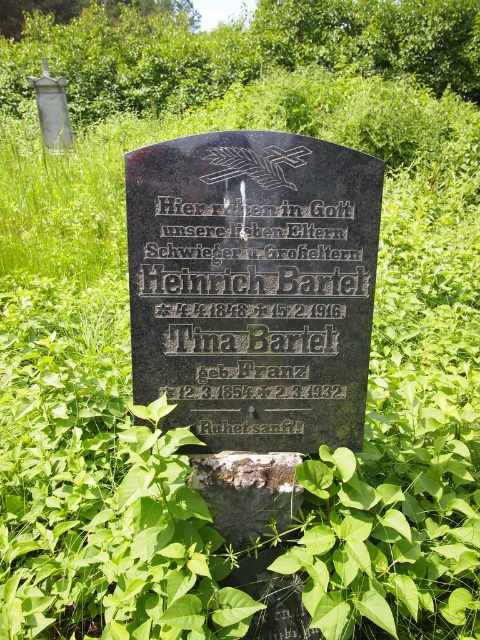
Does black polished stone plaque at center appear on the left side of rusty metal gravestone at center?

Yes, black polished stone plaque at center is to the left of rusty metal gravestone at center.

Is black polished stone plaque at center behind rusty metal gravestone at center?

No, black polished stone plaque at center is closer to the viewer.

Who is more forward, (296, 326) or (225, 467)?

Point (296, 326)

Image resolution: width=480 pixels, height=640 pixels. I want to click on black polished stone plaque at center, so [253, 285].